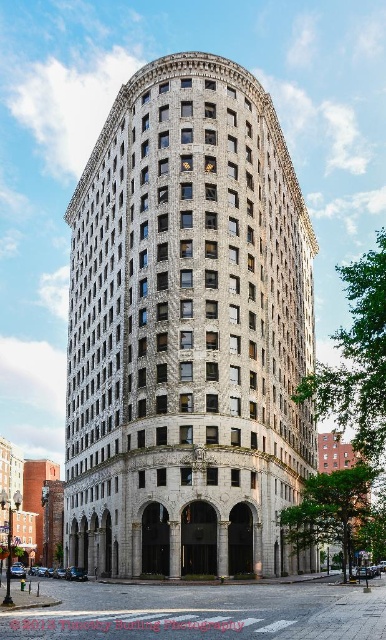
You are a surveyor measuring distances between structures. You have a drone that can fly up to 25 meters. Can your drone safely fly from the white stone building at center to the brick building at lower right without exceeding its maximum range?

The white stone building at center is 24.54 meters from the brick building at lower right. Since the drone can fly up to 25 meters, it can safely make the trip without exceeding its maximum range.

You are standing in front of the white stone building at center and the brick building at lower right. Which building is closer to you?

The white stone building at center is closer to you because it is positioned further to the viewer than the brick building at lower right.

You are an architect evaluating two buildings in the image. The white stone building at center and the brick building at lower right. Which one has a bigger footprint?

The white stone building at center is larger in size than the brick building at lower right, so it has a bigger footprint.